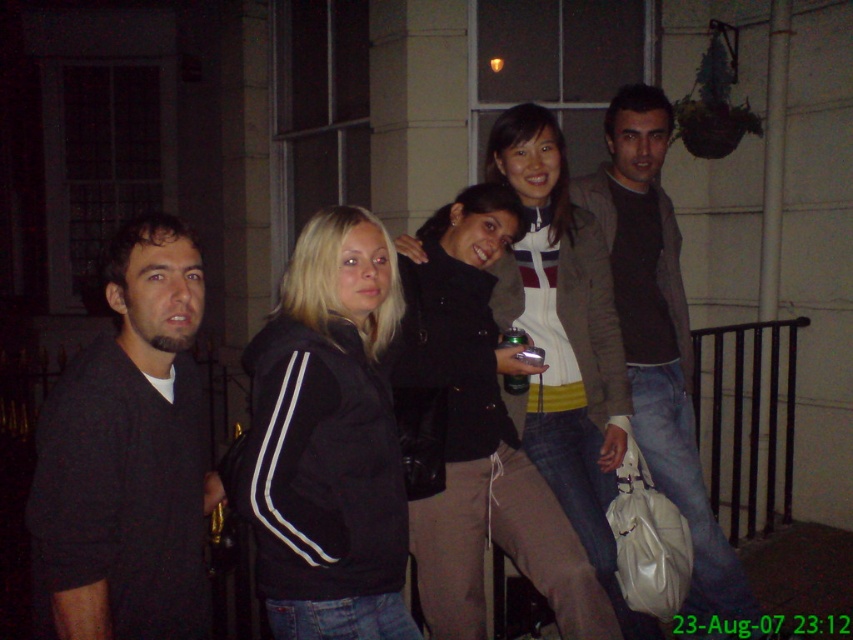
You are trying to find the dark brown sweater at center in a group photo. Which direction should you look from the dark matte sweater at left to locate it?

The dark brown sweater at center is to the right of the dark matte sweater at left.

You are standing at the center of the image and want to find the black leather jacket at center. According to the coordinates given, in which direction should you look to locate it?

The black leather jacket at center is located at coordinates point (563, 365), so you should look slightly to the right and downward from the very center to locate it.